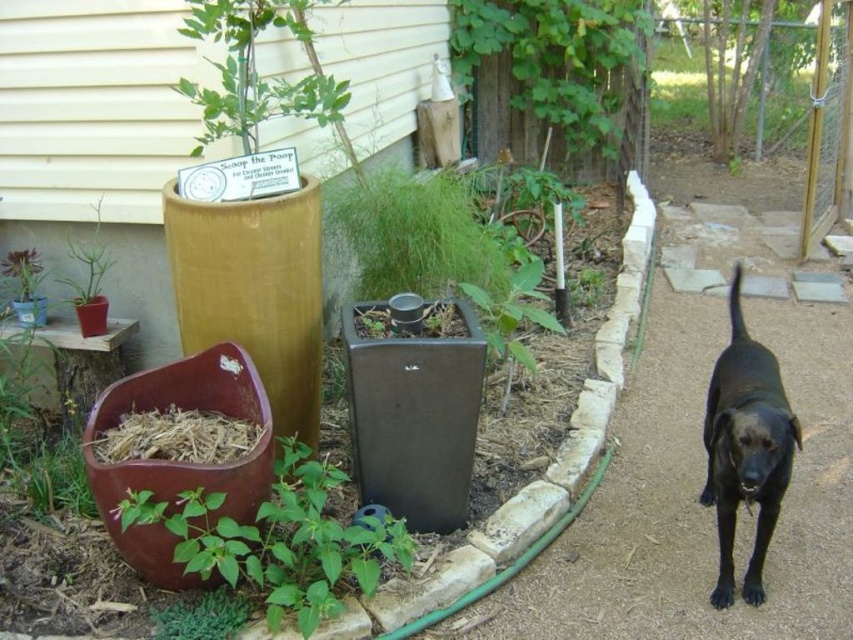
Can you confirm if matte black planter at center is positioned to the right of matte brown pot at lower left?

Indeed, matte black planter at center is positioned on the right side of matte brown pot at lower left.

Can you confirm if matte black planter at center is taller than matte brown pot at lower left?

Correct, matte black planter at center is much taller as matte brown pot at lower left.

The height and width of the screenshot is (640, 853). Find the location of `matte black planter at center`. matte black planter at center is located at coordinates (415, 419).

This screenshot has width=853, height=640. What are the coordinates of `matte black planter at center` in the screenshot? It's located at (415, 419).

Which is below, green leafy plant at upper center or matte brown pot at lower left?

matte brown pot at lower left is below.

Does point (639, 99) come farther from viewer compared to point (36, 305)?

That is True.

Where is `green leafy plant at upper center`? The height and width of the screenshot is (640, 853). green leafy plant at upper center is located at coordinates (555, 65).

Is green leafy plant at lower center above matte plastic pot at lower left?

No.

Is green leafy plant at lower center wider than matte plastic pot at lower left?

Yes.

Image resolution: width=853 pixels, height=640 pixels. I want to click on green leafy plant at lower center, so click(x=277, y=540).

Locate an element on the screen. The height and width of the screenshot is (640, 853). green leafy plant at lower center is located at coordinates (277, 540).